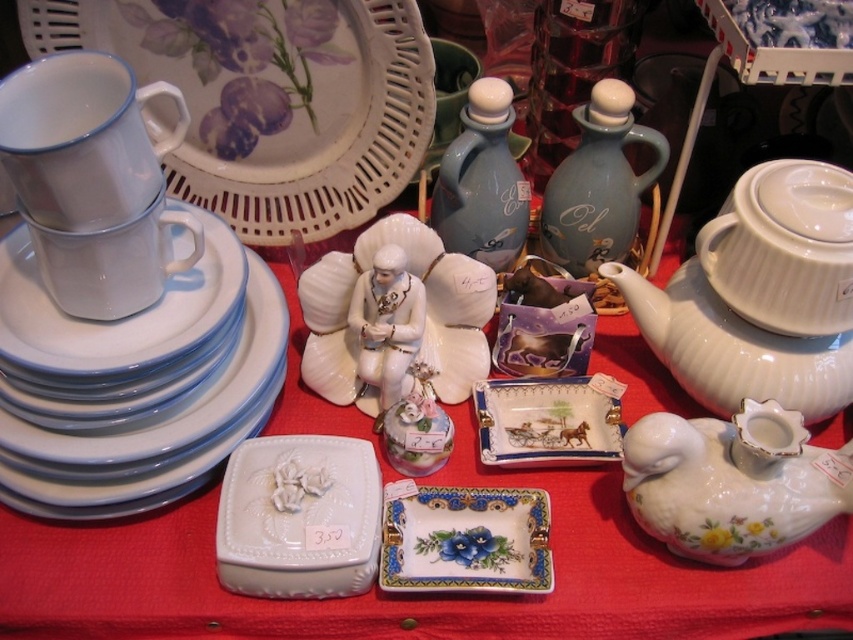
You are a customer at an antique shop and want to pick up the white glossy platter at upper left and the porcelain tray at center. Which item should you reach for first to grab the one closer to you?

The white glossy platter at upper left is closer to the viewer than the porcelain tray at center, so you should reach for the white glossy platter at upper left first.